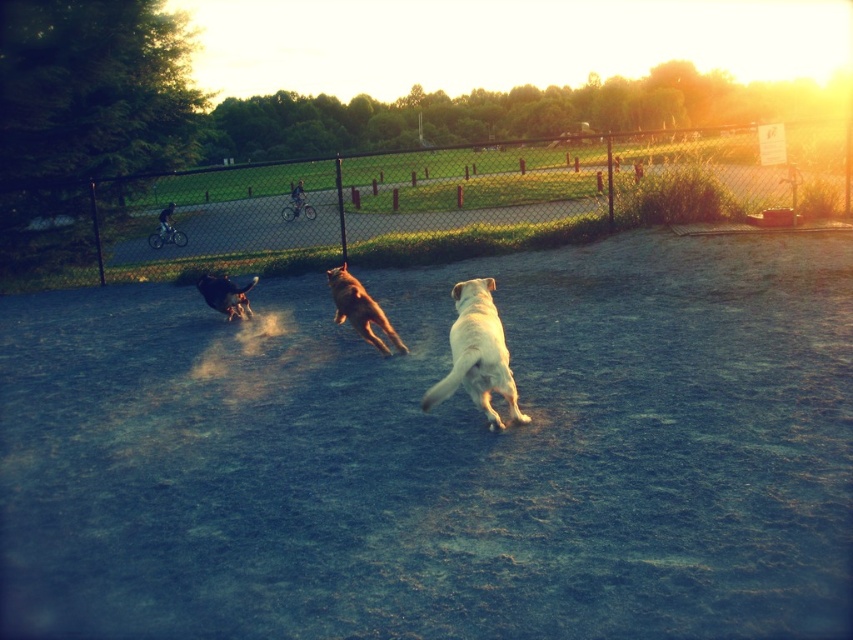
You are standing at the center of the dog park and want to throw a ball to the point that is closer to you. Which point should you aim for, point (366, 298) or point (247, 308)?

Point (366, 298) is closer to the viewer than point (247, 308), so you should aim for point (366, 298).

You are a photographer at the dog park and want to capture a photo where both the light yellow fur at center and the golden fur dog at center are clearly visible. Given their sizes, which dog should you focus on to ensure both are in frame without zooming in too much?

The light yellow fur at center has a lesser width compared to golden fur dog at center, so you should focus on the golden fur dog at center since it is larger and will remain visible even if the light yellow fur at center is smaller in the frame.